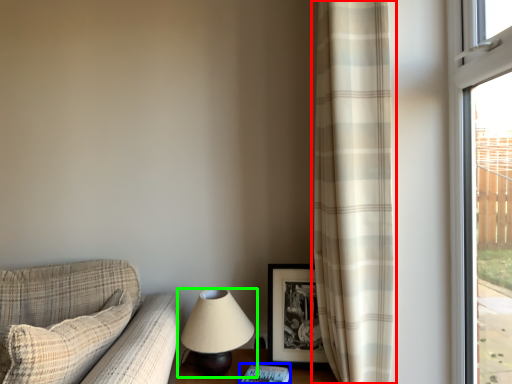
Question: Which object is the closest to the curtain (highlighted by a red box)? Choose among these: book (highlighted by a blue box) or lamp (highlighted by a green box).

Choices:
 (A) book
 (B) lamp

Answer: (B)